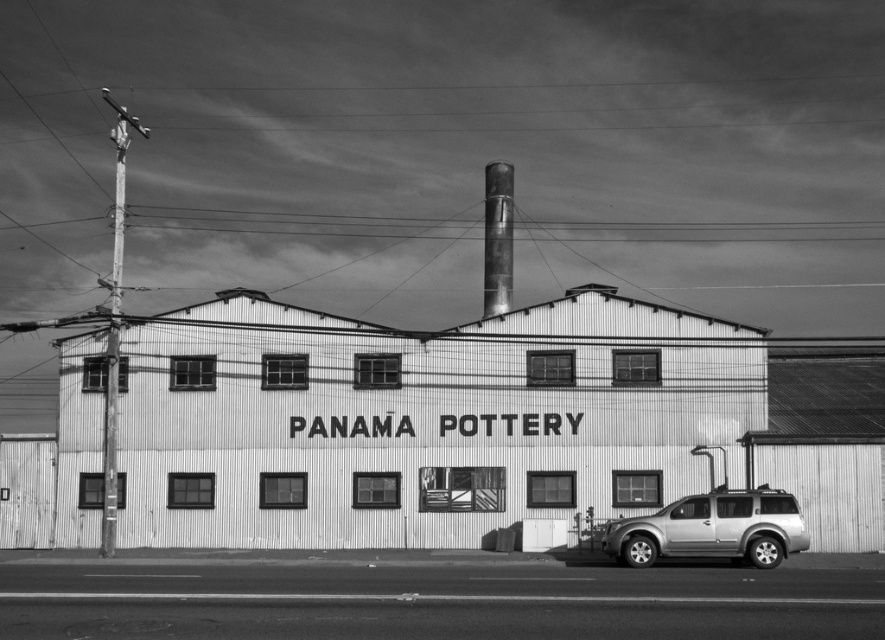
Does metallic corrugated building at center appear on the left side of silver metallic suv at lower right?

Correct, you'll find metallic corrugated building at center to the left of silver metallic suv at lower right.

Where is `metallic corrugated building at center`? The image size is (885, 640). metallic corrugated building at center is located at coordinates (476, 422).